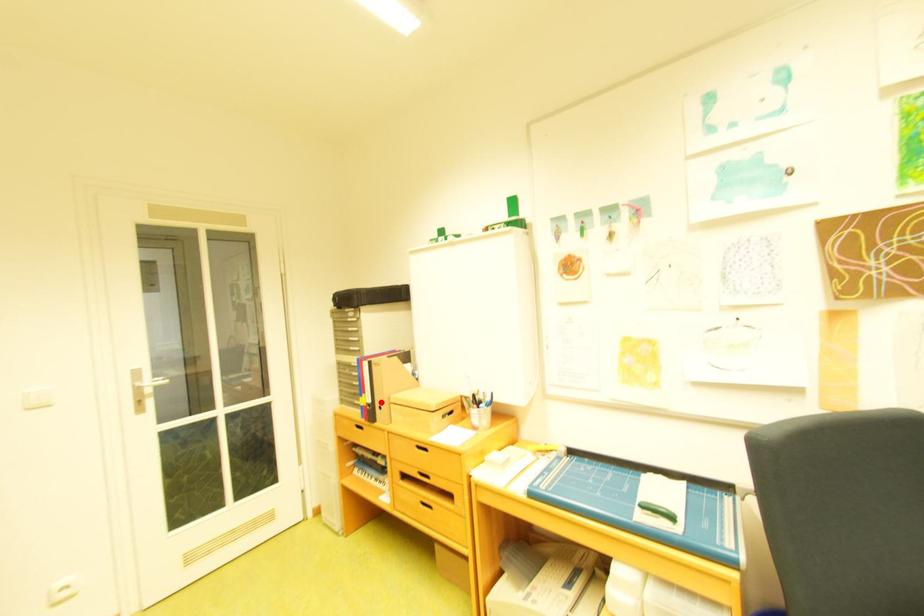
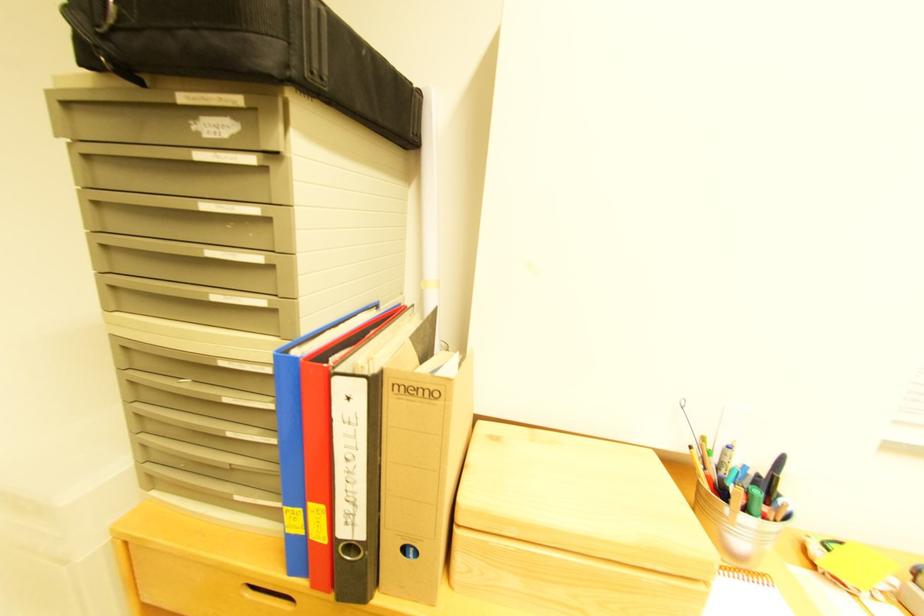
Locate, in the second image, the point that corresponds to the highlighted location in the first image.

(371, 536)